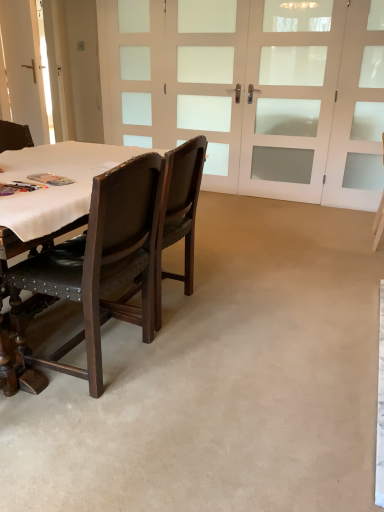
Question: Does white frosted glass screen door at upper right, marked as the 1th screen door in a right-to-left arrangement, appear on the left side of white leather chair at right, the third chair from the left?

Choices:
 (A) yes
 (B) no

Answer: (B)

Question: Is white frosted glass screen door at upper right, marked as the 1th screen door in a right-to-left arrangement, further to the viewer compared to white leather chair at right, the 1th chair when ordered from back to front?

Choices:
 (A) no
 (B) yes

Answer: (B)

Question: Is white frosted glass screen door at upper right, acting as the 3th screen door starting from the left, located outside white leather chair at right, the 3th chair from the front?

Choices:
 (A) no
 (B) yes

Answer: (B)

Question: Is white frosted glass screen door at upper right, marked as the 1th screen door in a right-to-left arrangement, next to white leather chair at right, the third chair from the left, and touching it?

Choices:
 (A) no
 (B) yes

Answer: (A)

Question: From a real-world perspective, does white frosted glass screen door at upper right, acting as the 3th screen door starting from the left, stand above white leather chair at right, the 1th chair when ordered from back to front?

Choices:
 (A) yes
 (B) no

Answer: (A)

Question: Relative to white leather chair at right, the third chair from the left, is white glass doors at center, positioned as the 3th screen door in right-to-left order, in front or behind?

Choices:
 (A) front
 (B) behind

Answer: (B)

Question: From a real-world perspective, is white glass doors at center, which is the first screen door in left-to-right order, positioned above or below white leather chair at right, the first chair when ordered from right to left?

Choices:
 (A) above
 (B) below

Answer: (A)

Question: From the image's perspective, is white glass doors at center, which is the first screen door in left-to-right order, positioned above or below white leather chair at right, the first chair when ordered from right to left?

Choices:
 (A) above
 (B) below

Answer: (A)

Question: Considering the positions of white glass doors at center, which is the first screen door in left-to-right order, and white leather chair at right, the 3th chair from the front, in the image, is white glass doors at center, which is the first screen door in left-to-right order, taller or shorter than white leather chair at right, the 3th chair from the front,?

Choices:
 (A) short
 (B) tall

Answer: (B)

Question: Is point pyautogui.click(x=69, y=181) positioned closer to the camera than point pyautogui.click(x=16, y=59)?

Choices:
 (A) closer
 (B) farther

Answer: (A)

Question: From a real-world perspective, is matte plastic book at table left above or below white glass barn door at upper left?

Choices:
 (A) below
 (B) above

Answer: (A)

Question: In the image, is matte plastic book at table left positioned in front of or behind white glass barn door at upper left?

Choices:
 (A) front
 (B) behind

Answer: (A)

Question: In the image, is matte plastic book at table left on the left side or the right side of white glass barn door at upper left?

Choices:
 (A) right
 (B) left

Answer: (A)

Question: Is point (369, 28) closer or farther from the camera than point (187, 227)?

Choices:
 (A) closer
 (B) farther

Answer: (B)

Question: Considering the positions of white frosted glass screen door at upper right, marked as the 1th screen door in a right-to-left arrangement, and brown leather chair at center, positioned as the 2th chair in left-to-right order, in the image, is white frosted glass screen door at upper right, marked as the 1th screen door in a right-to-left arrangement, bigger or smaller than brown leather chair at center, positioned as the 2th chair in left-to-right order,?

Choices:
 (A) small
 (B) big

Answer: (A)